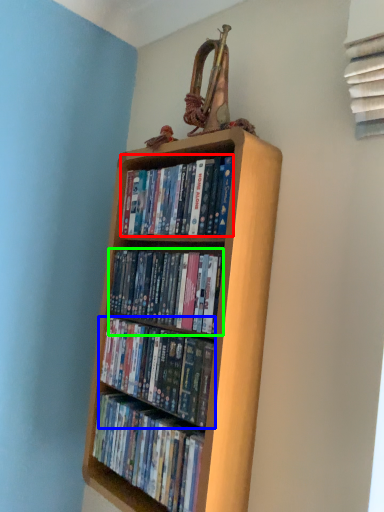
Question: Based on their relative distances, which object is farther from book (highlighted by a red box)? Choose from book (highlighted by a blue box) and book (highlighted by a green box).

Choices:
 (A) book
 (B) book

Answer: (A)